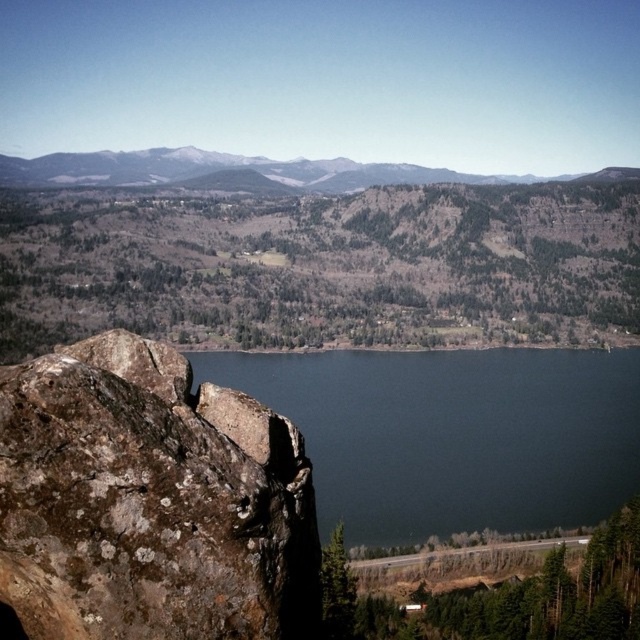
In the scene shown: Is dark blue water at center thinner than snowy rocky mountain at upper center?

Yes, dark blue water at center is thinner than snowy rocky mountain at upper center.

Describe the element at coordinates (452, 435) in the screenshot. I see `dark blue water at center` at that location.

Who is more forward, (577, 444) or (45, 182)?

Point (577, 444)

Identify the location of dark blue water at center. This screenshot has height=640, width=640. (452, 435).

Is brown rough rock at left positioned at the back of snowy rocky mountain at upper center?

That is False.

Identify the location of brown rough rock at left. This screenshot has height=640, width=640. (150, 502).

Is point (282, 432) less distant than point (17, 170)?

Yes.

I want to click on brown rough rock at left, so click(x=150, y=502).

Who is lower down, brown rough rock at left or dark blue water at center?

brown rough rock at left

Is point (236, 452) positioned behind point (424, 493)?

No, (236, 452) is closer to viewer.

The width and height of the screenshot is (640, 640). I want to click on brown rough rock at left, so click(x=150, y=502).